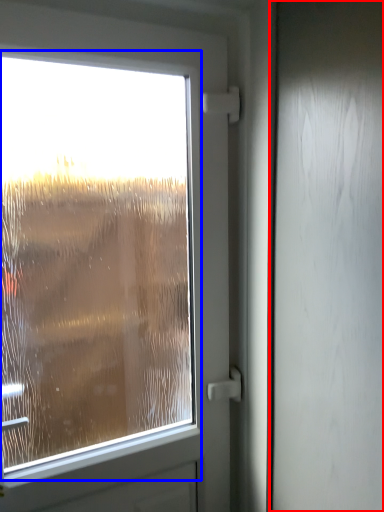
Question: Among these objects, which one is farthest to the camera, screen door (highlighted by a red box) or airplane window (highlighted by a blue box)?

Choices:
 (A) screen door
 (B) airplane window

Answer: (B)